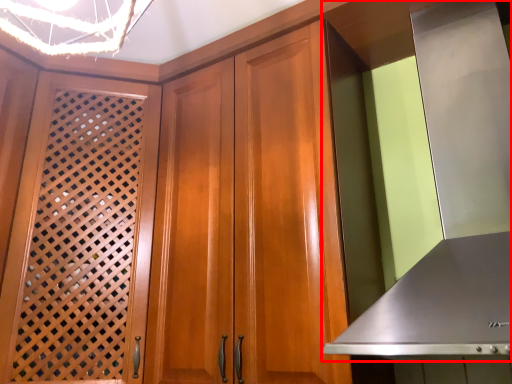
Question: From the image's perspective, what is the correct spatial positioning of exhaust hood (annotated by the red box) in reference to screen door?

Choices:
 (A) above
 (B) below

Answer: (A)